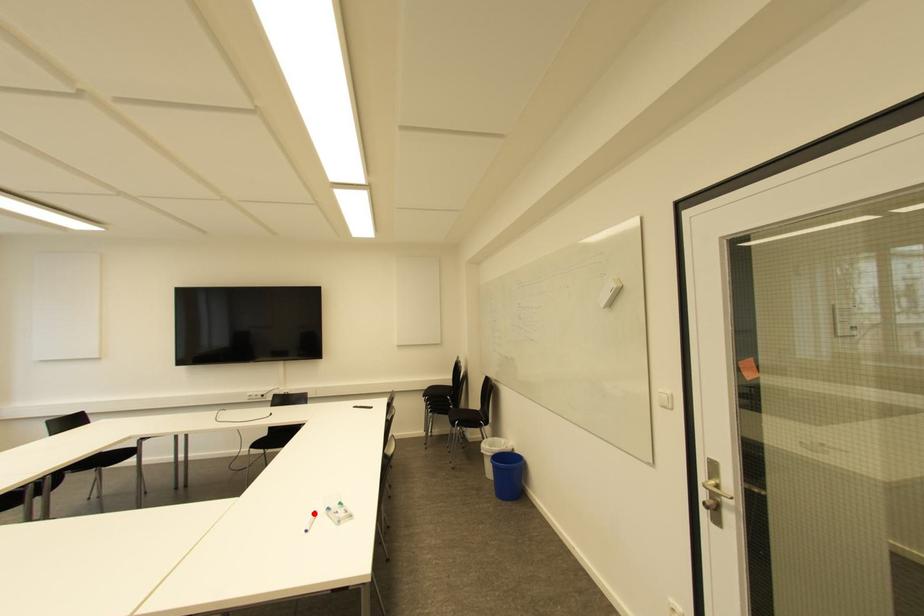
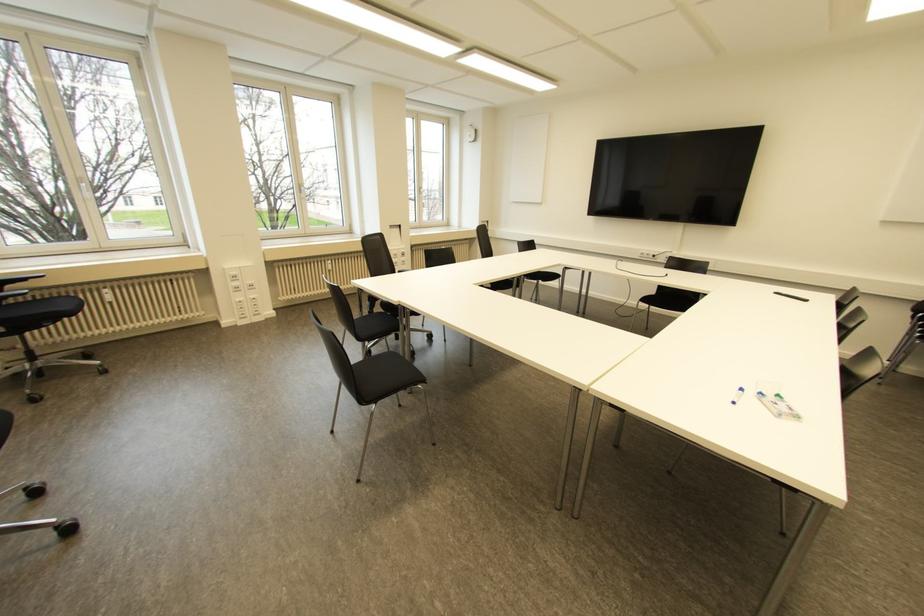
Locate, in the second image, the point that corresponds to the highlighted location in the first image.

(739, 390)